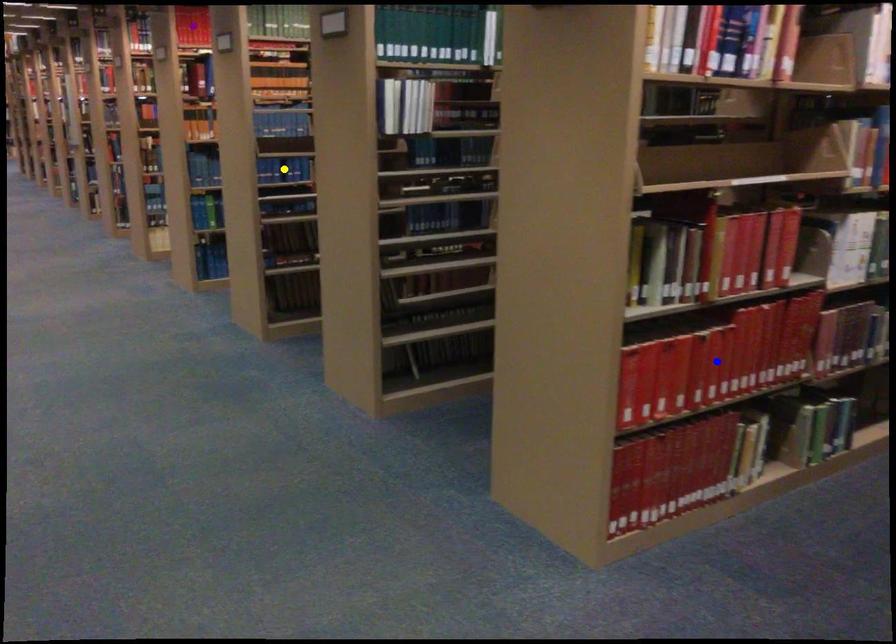
Order these from nearest to farthest:
1. purple point
2. blue point
3. yellow point

blue point, purple point, yellow point